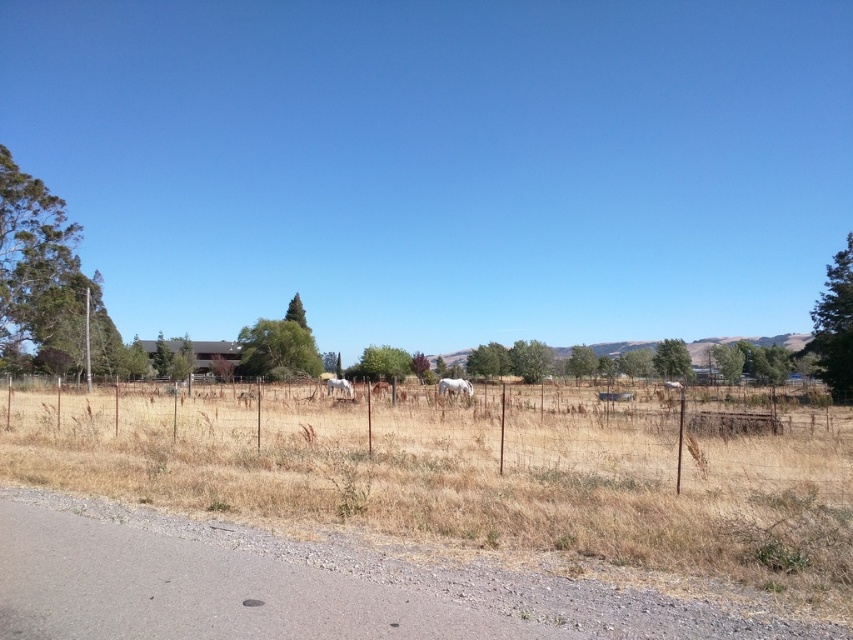
You are standing on the paved road and see the dry grass at center and the white glossy horse at center. Which object is closer to your right side?

The white glossy horse at center is closer to your right side because the dry grass at center is to the left of it.

You are a photographer trying to capture a wide shot of the dry grass at center and the white matte horse at center. Based on their sizes in the image, which one would appear broader in the photo?

The dry grass at center appears broader in the photo because its width is larger than that of the white matte horse at center.

You are a photographer wanting to capture both the white glossy horse at center and the white matte horse at center in a single frame. Given that your camera has a fixed focal length, which horse would appear taller in the photo?

The white glossy horse at center would appear taller in the photo because it has a greater height compared to the white matte horse at center.